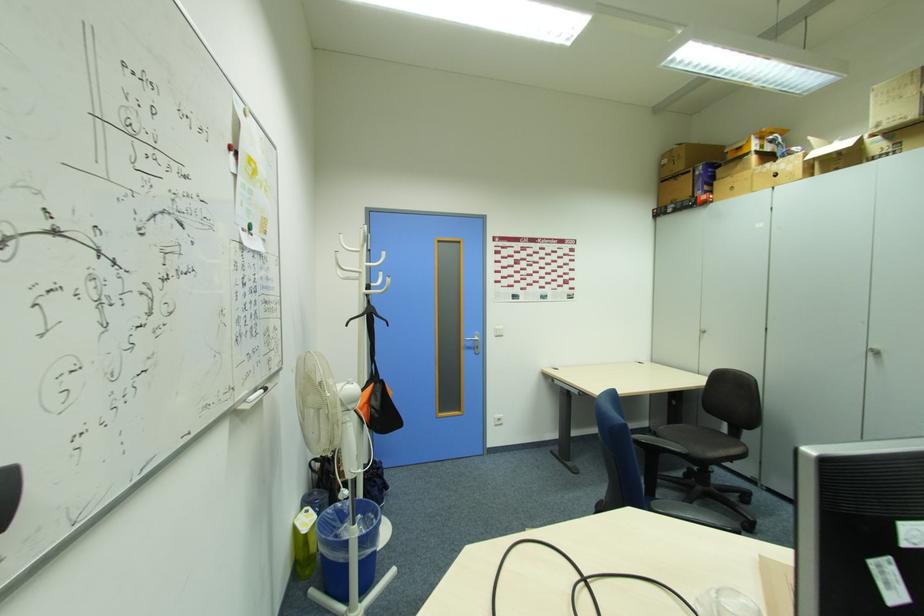
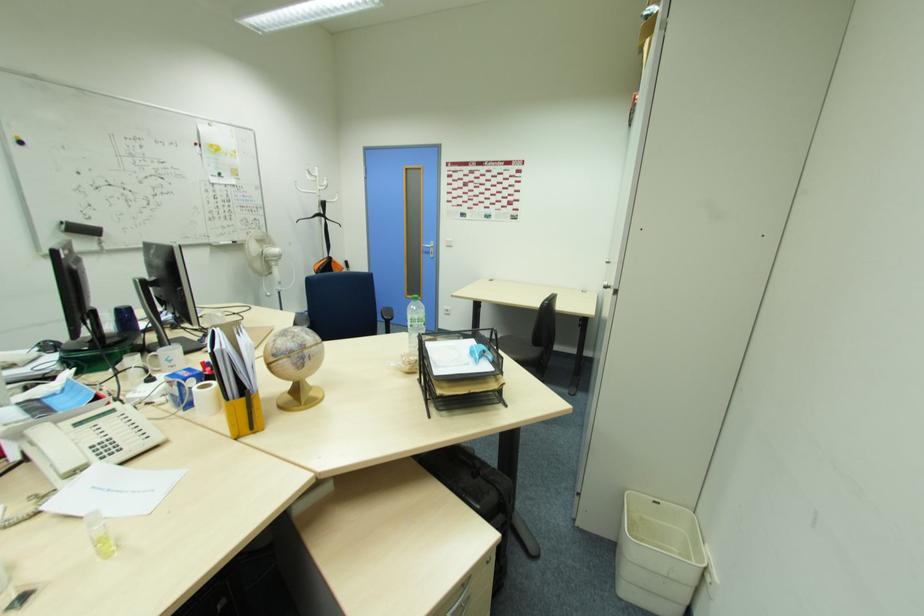
Find the pixel in the second image that matches pixel 472 346 in the first image.

(430, 252)